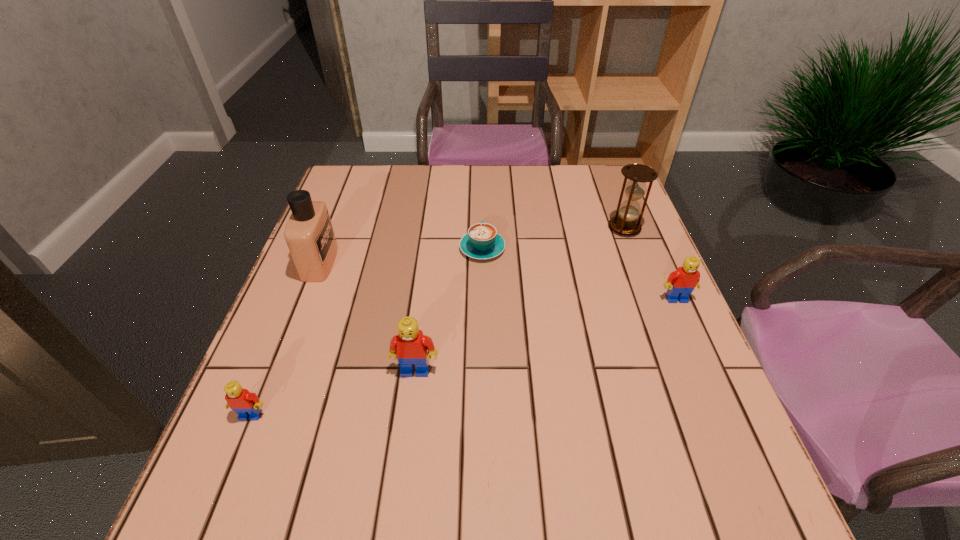
Find the location of a particular element. vacant space situated on the face of the third shortest object is located at coordinates pos(713,384).

At what (x,y) coordinates should I click in order to perform the action: click on free region located with the handle on the right side of the shortest object. Please return your answer as a coordinate pair (x, y). The width and height of the screenshot is (960, 540). Looking at the image, I should click on (482, 182).

Identify the location of free region located with the handle on the right side of the shortest object. The height and width of the screenshot is (540, 960). (482, 200).

At what (x,y) coordinates should I click in order to perform the action: click on vacant space positioned with the handle on the right side of the shortest object. Please return your answer as a coordinate pair (x, y). This screenshot has width=960, height=540. Looking at the image, I should click on (482, 217).

In order to click on vacant space situated on the front of the hourglass in this screenshot , I will do `click(659, 319)`.

The image size is (960, 540). Identify the location of vacant space located 0.090m on the front label of the perfume. (371, 262).

The image size is (960, 540). Find the location of `object present at the near edge`. object present at the near edge is located at coordinates (246, 404).

Locate an element on the screen. The image size is (960, 540). Lego that is at the left edge is located at coordinates pyautogui.click(x=246, y=404).

This screenshot has height=540, width=960. Identify the location of perfume that is positioned at the left edge. (309, 234).

This screenshot has height=540, width=960. Find the location of `Lego positioned at the right edge`. Lego positioned at the right edge is located at coordinates (681, 283).